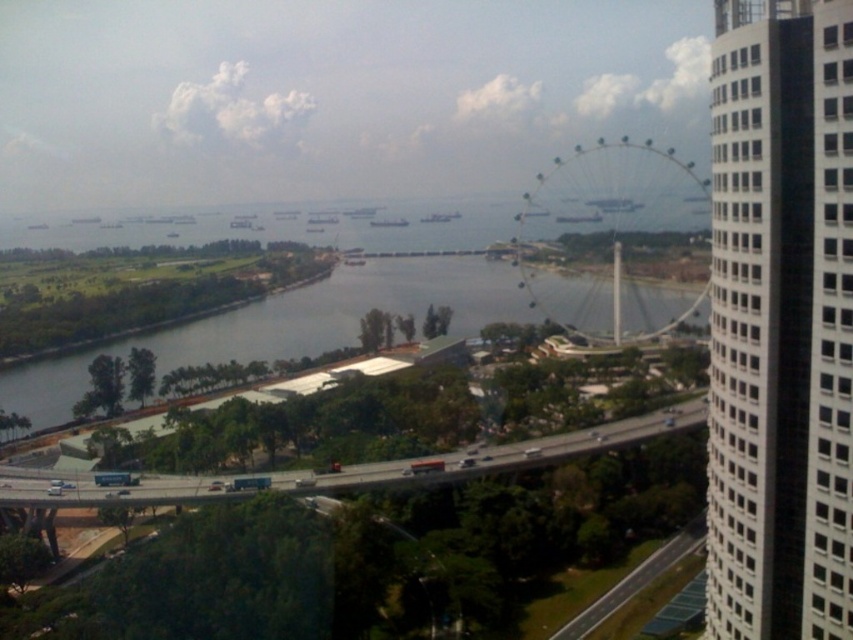
Can you confirm if metallic ferris wheel at center is shorter than metallic silver ferris wheel at center?

Yes, metallic ferris wheel at center is shorter than metallic silver ferris wheel at center.

Which is in front, point (189, 516) or point (683, 228)?

Point (189, 516) is more forward.

Image resolution: width=853 pixels, height=640 pixels. Find the location of `metallic ferris wheel at center`. metallic ferris wheel at center is located at coordinates (384, 552).

I want to click on white glass building at right, so click(x=780, y=321).

Which is in front, point (740, 589) or point (32, 365)?

Point (740, 589) is in front.

Locate an element on the screen. white glass building at right is located at coordinates (780, 321).

Can you confirm if white glass building at right is shorter than metallic ferris wheel at center?

Incorrect, white glass building at right's height does not fall short of metallic ferris wheel at center's.

Who is more forward, (x=834, y=211) or (x=541, y=570)?

Point (x=834, y=211)

Between point (822, 353) and point (479, 467), which one is positioned behind?

The point (479, 467) is more distant.

This screenshot has height=640, width=853. What are the coordinates of `white glass building at right` in the screenshot? It's located at (780, 321).